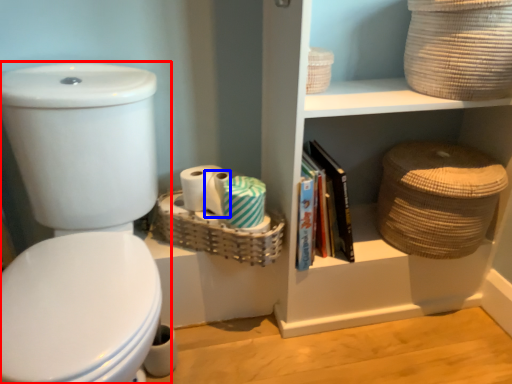
Question: Which of the following is the closest to the observer, toilet (highlighted by a red box) or toilet paper (highlighted by a blue box)?

Choices:
 (A) toilet
 (B) toilet paper

Answer: (A)